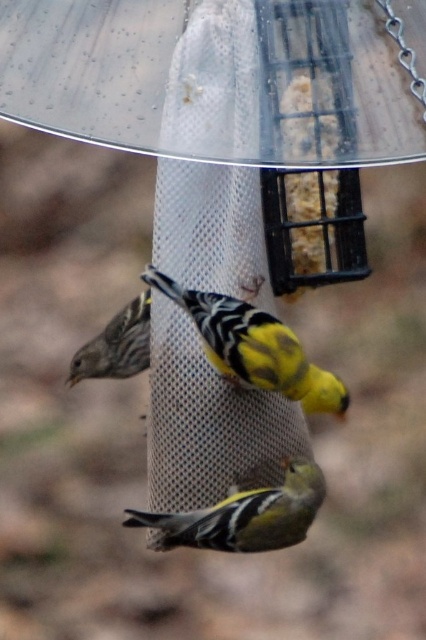
Question: Does yellow matte sparrow at center come in front of yellow-green feathers at center?

Choices:
 (A) no
 (B) yes

Answer: (B)

Question: Estimate the real-world distances between objects in this image. Which object is closer to the yellow-green feathers at center?

Choices:
 (A) yellow matte sparrow at center
 (B) matte brown pinecone at left

Answer: (A)

Question: Can you confirm if yellow-green feathers at center is wider than matte brown pinecone at left?

Choices:
 (A) no
 (B) yes

Answer: (B)

Question: Where is yellow-green feathers at center located in relation to matte brown pinecone at left in the image?

Choices:
 (A) below
 (B) above

Answer: (A)

Question: Among these objects, which one is farthest from the camera?

Choices:
 (A) matte brown pinecone at left
 (B) yellow-green feathers at center

Answer: (A)

Question: Estimate the real-world distances between objects in this image. Which object is farther from the yellow matte sparrow at center?

Choices:
 (A) matte brown pinecone at left
 (B) yellow-green feathers at center

Answer: (B)